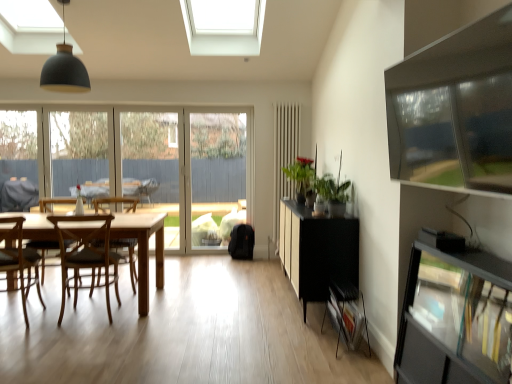
Identify the location of clear glass window frame at left, the 2th window frame viewed from the right. (20, 160).

Describe the element at coordinates (20, 160) in the screenshot. This screenshot has height=384, width=512. I see `clear glass window frame at left, the 2th window frame viewed from the right` at that location.

What do you see at coordinates (453, 134) in the screenshot?
I see `transparent glass window screen at upper right` at bounding box center [453, 134].

The width and height of the screenshot is (512, 384). Describe the element at coordinates (87, 257) in the screenshot. I see `wooden chair at left, the second chair positioned from the front` at that location.

At what (x,y) coordinates should I click in order to perform the action: click on clear glass door at center. Please return your answer as a coordinate pair (x, y). Looking at the image, I should click on (82, 153).

Image resolution: width=512 pixels, height=384 pixels. In order to click on transparent glass shelf at right in this screenshot , I will do `click(455, 319)`.

Identify the location of wooden chair at center, which appears as the 1th chair when viewed from the back. (129, 256).

Is clear glass door at center far away from transparent glass window screen at upper right?

That's right, there is a large distance between clear glass door at center and transparent glass window screen at upper right.

Do you think clear glass door at center is within transparent glass window screen at upper right, or outside of it?

clear glass door at center is not enclosed by transparent glass window screen at upper right.

Does clear glass door at center have a larger size compared to transparent glass window screen at upper right?

Incorrect, clear glass door at center is not larger than transparent glass window screen at upper right.

Is white textured radiator at center not within light brown wooden table at left?

Result: Absolutely, white textured radiator at center is external to light brown wooden table at left.

How distant is white textured radiator at center from light brown wooden table at left?

They are 7.21 feet apart.

Does point (275, 109) appear closer or farther from the camera than point (162, 223)?

Point (275, 109) is farther from the camera than point (162, 223).

The height and width of the screenshot is (384, 512). In order to click on kitchen & dining room table beneath the white textured radiator at center (from a real-world perspective) in this screenshot , I will do `click(143, 247)`.

Looking at the image, does clear glass window frame at left, the first window frame when ordered from left to right, seem bigger or smaller compared to wooden chair at left, the third chair when ordered from back to front?

clear glass window frame at left, the first window frame when ordered from left to right, is smaller than wooden chair at left, the third chair when ordered from back to front.

Between clear glass window frame at left, the 2th window frame viewed from the right, and wooden chair at left, which is the 1th chair in front-to-back order, which one is positioned in front?

wooden chair at left, which is the 1th chair in front-to-back order, is more forward.

From the image's perspective, count 2nd window frames upward from the wooden chair at left, which is the 1th chair in front-to-back order, and point to it. Please provide its 2D coordinates.

[(20, 160)]

From a real-world perspective, between clear glass window frame at left, the 2th window frame viewed from the right, and wooden chair at left, which is the 1th chair in front-to-back order, who is vertically higher?

From a 3D spatial view, clear glass window frame at left, the 2th window frame viewed from the right, is above.

Is transparent glass shelf at right next to wooden chair at left, the third chair when ordered from back to front?

No, transparent glass shelf at right is not making contact with wooden chair at left, the third chair when ordered from back to front.

The width and height of the screenshot is (512, 384). In order to click on chair that is the 1st object located behind the transparent glass shelf at right in this screenshot , I will do `click(19, 259)`.

Are wooden chair at center, acting as the third chair starting from the front, and matte black pendant lamp at upper left beside each other?

No, wooden chair at center, acting as the third chair starting from the front, is not with matte black pendant lamp at upper left.

From a real-world perspective, is wooden chair at center, acting as the third chair starting from the front, below matte black pendant lamp at upper left?

Correct, in the physical world, wooden chair at center, acting as the third chair starting from the front, is lower than matte black pendant lamp at upper left.

Considering the sizes of objects wooden chair at center, acting as the third chair starting from the front, and matte black pendant lamp at upper left in the image provided, who is taller, wooden chair at center, acting as the third chair starting from the front, or matte black pendant lamp at upper left?

wooden chair at center, acting as the third chair starting from the front, is taller.

In the scene shown: Who is more distant, wooden chair at left, the third chair when ordered from back to front, or transparent glass door at center, which appears as the 1th window frame when viewed from the right?

transparent glass door at center, which appears as the 1th window frame when viewed from the right.

In terms of width, does wooden chair at left, which is the 1th chair in front-to-back order, look wider or thinner when compared to transparent glass door at center, which appears as the 1th window frame when viewed from the right?

Clearly, wooden chair at left, which is the 1th chair in front-to-back order, has more width compared to transparent glass door at center, which appears as the 1th window frame when viewed from the right.

Is wooden chair at left, which is the 1th chair in front-to-back order, bigger or smaller than transparent glass door at center, the 2th window frame in the left-to-right sequence?

Clearly, wooden chair at left, which is the 1th chair in front-to-back order, is smaller in size than transparent glass door at center, the 2th window frame in the left-to-right sequence.

Image resolution: width=512 pixels, height=384 pixels. Find the location of `window frame lying on the left of light brown wooden table at left`. window frame lying on the left of light brown wooden table at left is located at coordinates (20, 160).

From a real-world perspective, is light brown wooden table at left over clear glass window frame at left, the 2th window frame viewed from the right?

No, from a real-world perspective, light brown wooden table at left is not above clear glass window frame at left, the 2th window frame viewed from the right.

Where is `window screen in front of the clear glass door at center`? window screen in front of the clear glass door at center is located at coordinates (453, 134).

The height and width of the screenshot is (384, 512). I want to click on curtain that appears behind the light brown wooden table at left, so click(284, 156).

Which object lies further to the anchor point black matte cabinet at right, transparent glass shelf at right or wooden chair at center, which appears as the 1th chair when viewed from the back?

wooden chair at center, which appears as the 1th chair when viewed from the back, is further to black matte cabinet at right.

From the image, which object appears to be nearer to light brown wooden table at left, white textured radiator at center or black matte cabinet at right?

Among the two, black matte cabinet at right is located nearer to light brown wooden table at left.

Based on their spatial positions, is clear glass window frame at left, the first window frame when ordered from left to right, or clear glass door at center closer to wooden chair at left, the third chair when ordered from back to front?

clear glass window frame at left, the first window frame when ordered from left to right, is closer to wooden chair at left, the third chair when ordered from back to front.

In the scene shown: Which object lies further to the anchor point clear glass window frame at left, the first window frame when ordered from left to right, wooden chair at left, the third chair when ordered from back to front, or clear glass door at center?

wooden chair at left, the third chair when ordered from back to front, is further to clear glass window frame at left, the first window frame when ordered from left to right.

When comparing their distances from clear glass window frame at left, the 2th window frame viewed from the right, does matte black pendant lamp at upper left or clear glass door at center seem closer?

clear glass door at center is closer to clear glass window frame at left, the 2th window frame viewed from the right.

From the image, which object appears to be farther from transparent glass window screen at upper right, clear glass window frame at left, the first window frame when ordered from left to right, or clear glass door at center?

clear glass window frame at left, the first window frame when ordered from left to right.

Estimate the real-world distances between objects in this image. Which object is further from clear glass door at center, white textured radiator at center or light brown wooden table at left?

Based on the image, light brown wooden table at left appears to be further to clear glass door at center.

Looking at the image, which one is located closer to white textured radiator at center, transparent glass shelf at right or wooden chair at left, which appears as the 2th chair when viewed from the back?

wooden chair at left, which appears as the 2th chair when viewed from the back, is closer to white textured radiator at center.

Locate an element on the screen. cabinetry between wooden chair at center, which appears as the 1th chair when viewed from the back, and transparent glass shelf at right is located at coordinates (316, 251).

The width and height of the screenshot is (512, 384). I want to click on light fixture between transparent glass shelf at right and transparent glass door at center, the 2th window frame in the left-to-right sequence, from front to back, so click(x=64, y=68).

Identify the location of curtain positioned between matte black pendant lamp at upper left and transparent glass door at center, the 2th window frame in the left-to-right sequence, from near to far. (284, 156).

Locate an element on the screen. The width and height of the screenshot is (512, 384). window frame positioned between wooden chair at left, the third chair when ordered from back to front, and clear glass door at center from near to far is located at coordinates [20, 160].